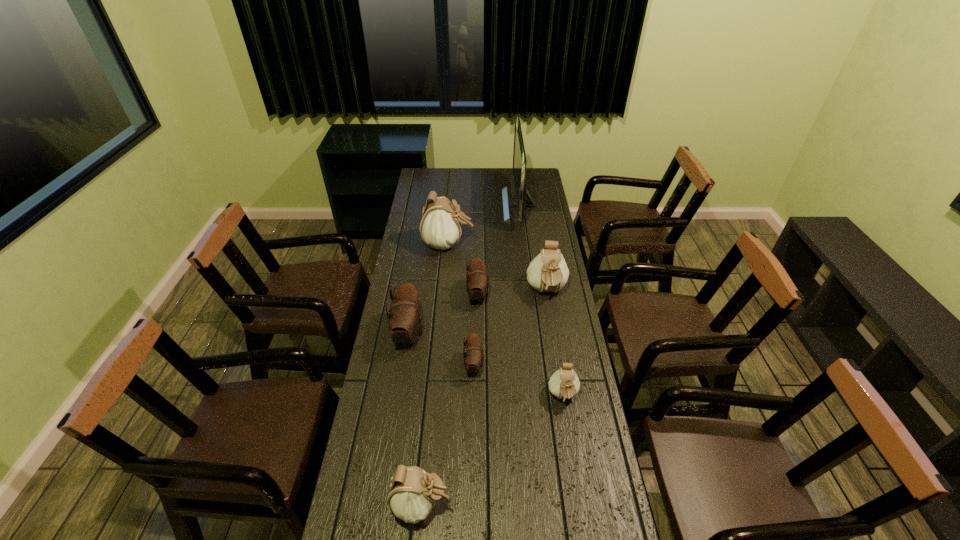
Where is `vacant region between the monitor and the farthest brown pouch`? The height and width of the screenshot is (540, 960). vacant region between the monitor and the farthest brown pouch is located at coordinates (498, 250).

You are a GUI agent. You are given a task and a screenshot of the screen. Output one action in this format:
    pyautogui.click(x=<x>, y=<y>)
    Task: Click on the vacant area between the second biggest brown pouch and the biggest brown pouch
    
    Given the screenshot: What is the action you would take?
    pyautogui.click(x=444, y=315)

This screenshot has height=540, width=960. Find the location of `empty space between the tallest pouch and the second farthest white pouch`. empty space between the tallest pouch and the second farthest white pouch is located at coordinates (497, 268).

Locate which object ranks fifth in proximity to the third smallest white pouch. Please provide its 2D coordinates. Your answer should be formatted as a tuple, i.e. [(x, y)], where the tuple contains the x and y coordinates of a point satisfying the conditions above.

[(564, 384)]

Identify which object is the fourth nearest to the biggest white pouch. Please provide its 2D coordinates. Your answer should be formatted as a tuple, i.e. [(x, y)], where the tuple contains the x and y coordinates of a point satisfying the conditions above.

[(404, 318)]

Select which pouch appears as the fifth closest to the biggest brown pouch. Please provide its 2D coordinates. Your answer should be formatted as a tuple, i.e. [(x, y)], where the tuple contains the x and y coordinates of a point satisfying the conditions above.

[(412, 494)]

Select which pouch appears as the fourth closest to the biggest brown pouch. Please provide its 2D coordinates. Your answer should be formatted as a tuple, i.e. [(x, y)], where the tuple contains the x and y coordinates of a point satisfying the conditions above.

[(547, 272)]

Locate which white pouch is the fourth closest to the monitor. Please provide its 2D coordinates. Your answer should be formatted as a tuple, i.e. [(x, y)], where the tuple contains the x and y coordinates of a point satisfying the conditions above.

[(412, 494)]

At what (x,y) coordinates should I click in order to perform the action: click on white pouch that is the second closest to the biggest brown pouch. Please return your answer as a coordinate pair (x, y). Looking at the image, I should click on (547, 272).

Identify which brown pouch is the third closest to the second nearest white pouch. Please provide its 2D coordinates. Your answer should be formatted as a tuple, i.e. [(x, y)], where the tuple contains the x and y coordinates of a point satisfying the conditions above.

[(404, 318)]